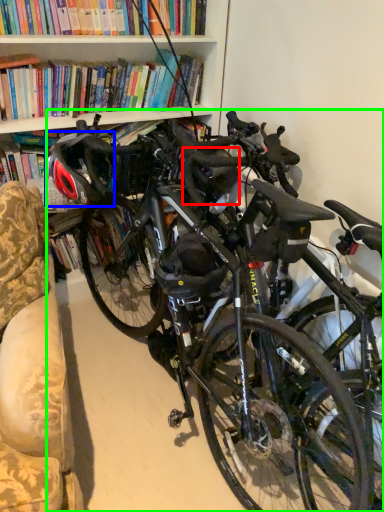
Question: Which is farther away from helmet (highlighted by a red box)? bicycle helmet (highlighted by a blue box) or bicycle (highlighted by a green box)?

Choices:
 (A) bicycle helmet
 (B) bicycle

Answer: (B)